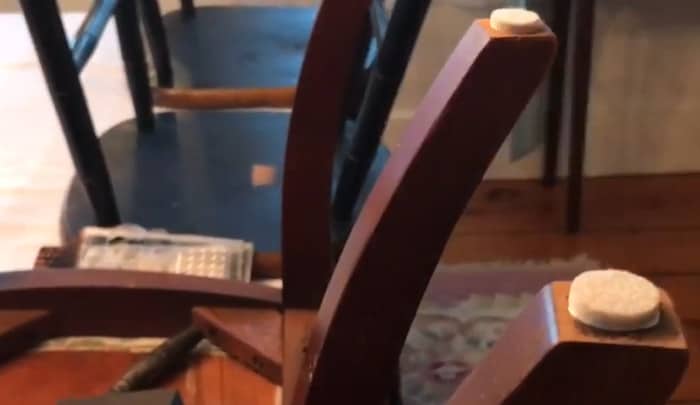
Identify the location of pink part of rug. The image size is (700, 405). (458, 283), (435, 379).